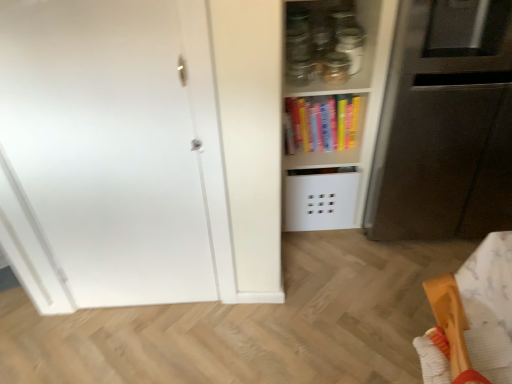
The image size is (512, 384). Identify the location of free location to the right of white matte door at left. (x=227, y=327).